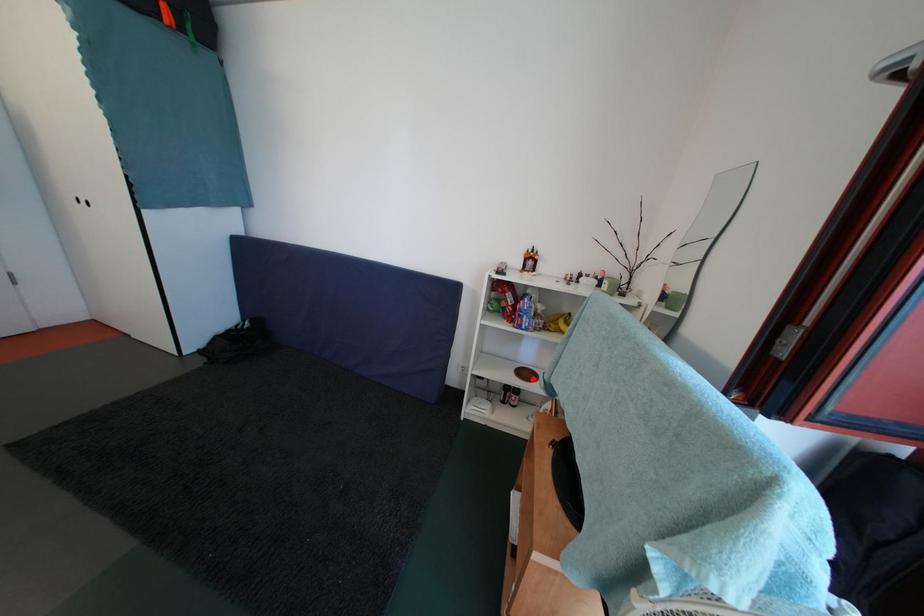
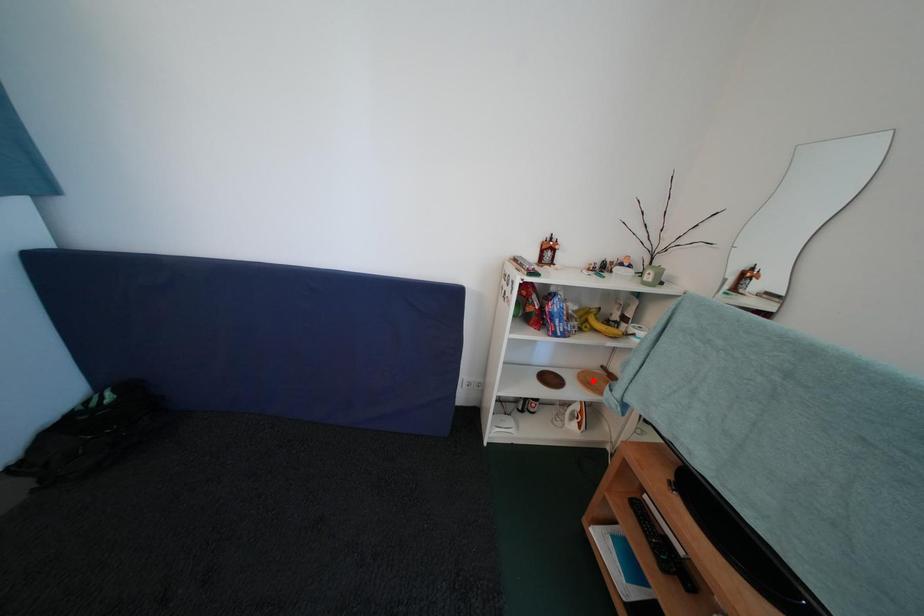
I am providing you with two images of the same scene from different viewpoints. A red point is marked on the first image and another point is marked on the second image. Is the marked point in image1 the same physical position as the marked point in image2?

No